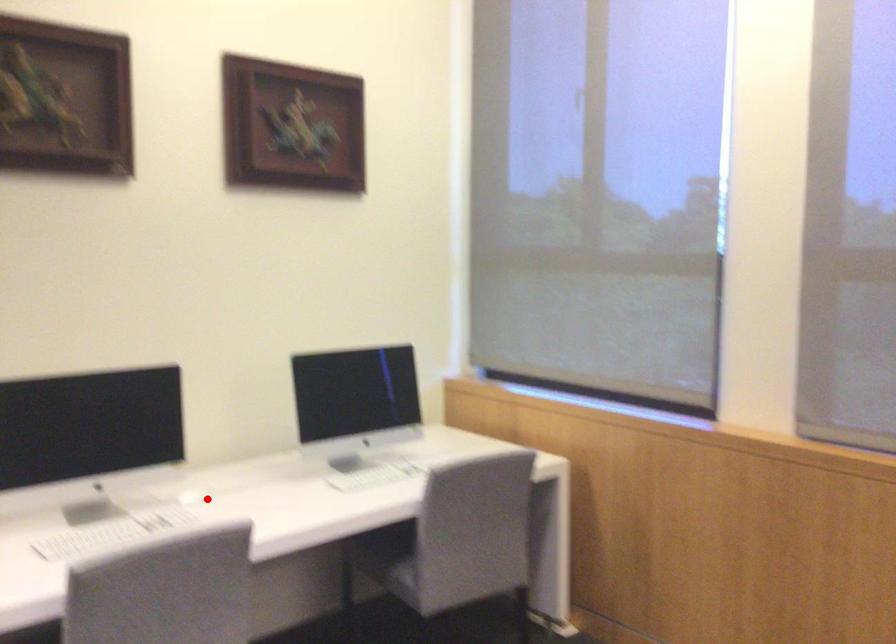
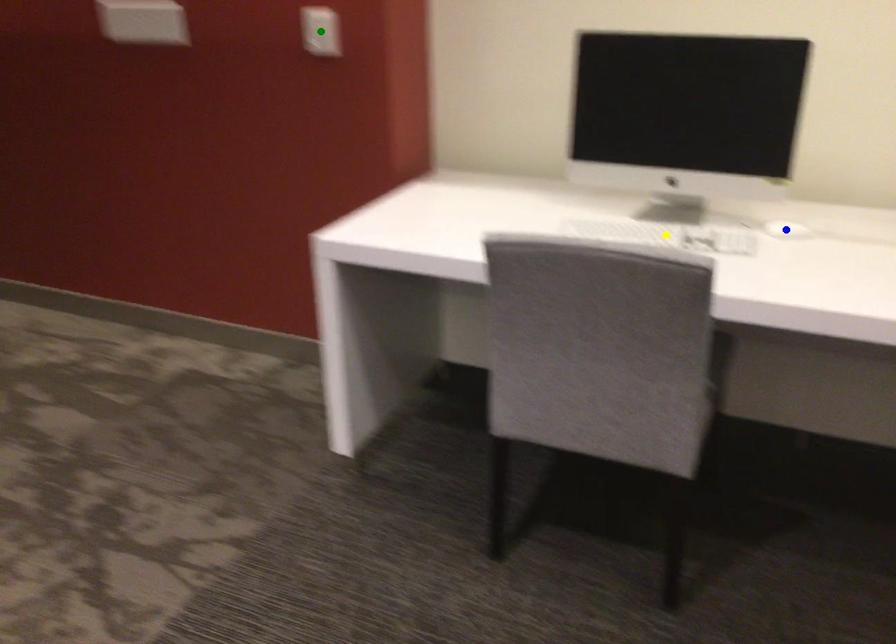
Question: I am providing you with two images of the same scene from different viewpoints. A red point is marked on the first image. You are given multiple points on the second image. Which point in image 2 represents the same 3d spot as the red point in image 1?

Choices:
 (A) blue point
 (B) yellow point
 (C) green point

Answer: (A)